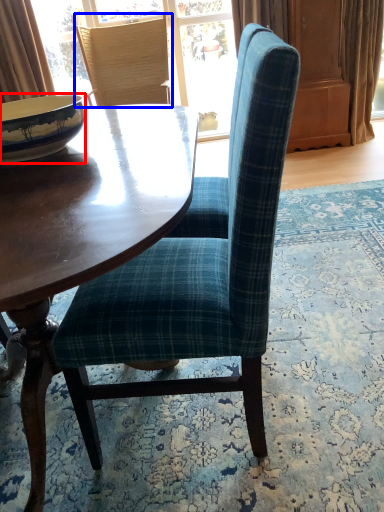
Question: Which object is further to the camera taking this photo, bowl (highlighted by a red box) or chair (highlighted by a blue box)?

Choices:
 (A) bowl
 (B) chair

Answer: (B)